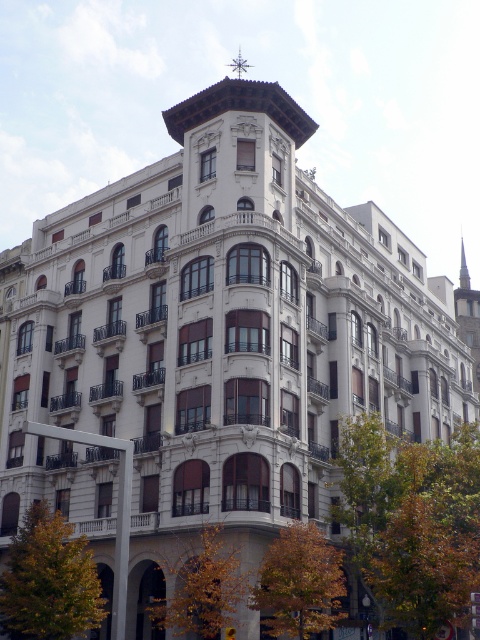
Does point (319, 541) come in front of point (155, 605)?

Yes, point (319, 541) is closer to viewer.

Is orange leafy tree at lower center to the left of yellow leafy tree at lower center from the viewer's perspective?

No, orange leafy tree at lower center is not to the left of yellow leafy tree at lower center.

You are a GUI agent. You are given a task and a screenshot of the screen. Output one action in this format:
    pyautogui.click(x=<x>, y=<y>)
    Task: Click on the orange leafy tree at lower center
    Image resolution: width=480 pixels, height=640 pixels.
    Given the screenshot: What is the action you would take?
    pyautogui.click(x=300, y=582)

Describe the element at coordinates (421, 570) in the screenshot. This screenshot has height=640, width=480. I see `brown leafy tree at lower right` at that location.

Does brown leafy tree at lower right appear over yellow leafy tree at lower center?

Indeed, brown leafy tree at lower right is positioned over yellow leafy tree at lower center.

Between point (435, 577) and point (207, 547), which one is positioned behind?

The point (207, 547) is behind.

This screenshot has width=480, height=640. Identify the location of brown leafy tree at lower right. (421, 570).

Is green leafy tree at lower left bigger than yellow leafy tree at lower center?

Correct, green leafy tree at lower left is larger in size than yellow leafy tree at lower center.

Is green leafy tree at lower left closer to camera compared to yellow leafy tree at lower center?

No.

Find the location of a particular element. green leafy tree at lower left is located at coordinates (48, 580).

Locate an element on the screen. green leafy tree at lower left is located at coordinates (48, 580).